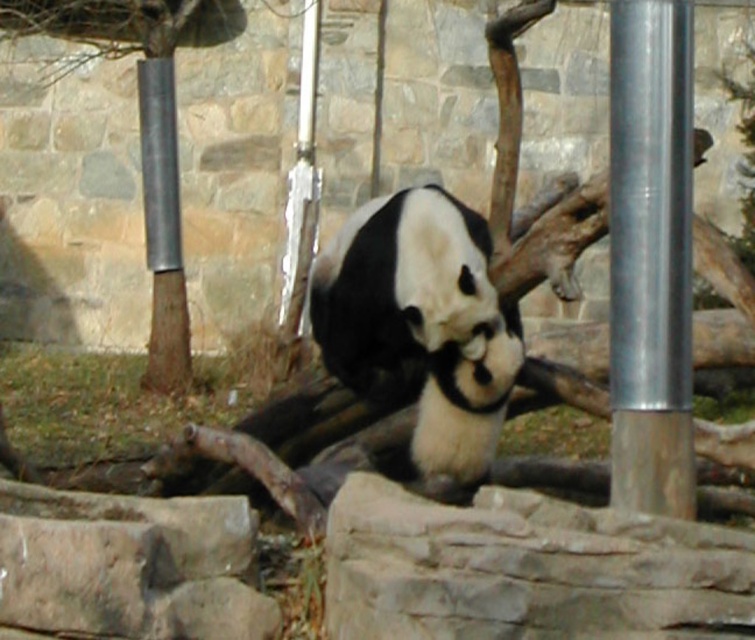
Who is lower down, black fuzzy panda at center or silver metallic pole at right?

black fuzzy panda at center

Describe the element at coordinates (421, 326) in the screenshot. I see `black fuzzy panda at center` at that location.

Find the location of a particular element. This screenshot has width=755, height=640. black fuzzy panda at center is located at coordinates (421, 326).

In order to click on black fuzzy panda at center in this screenshot , I will do `click(421, 326)`.

Can you confirm if black fuzzy panda at center is thinner than metallic smooth pole at left?

Incorrect, black fuzzy panda at center's width is not less than metallic smooth pole at left's.

Describe the element at coordinates (421, 326) in the screenshot. The height and width of the screenshot is (640, 755). I see `black fuzzy panda at center` at that location.

Find the location of a particular element. This screenshot has height=640, width=755. black fuzzy panda at center is located at coordinates [x=421, y=326].

Is the position of silver metallic pole at right more distant than that of metallic smooth pole at left?

No, silver metallic pole at right is in front of metallic smooth pole at left.

Which is more to the right, silver metallic pole at right or metallic smooth pole at left?

Positioned to the right is silver metallic pole at right.

Is point (626, 374) farther from camera compared to point (165, 141)?

No, (626, 374) is in front of (165, 141).

This screenshot has width=755, height=640. I want to click on silver metallic pole at right, so click(x=649, y=256).